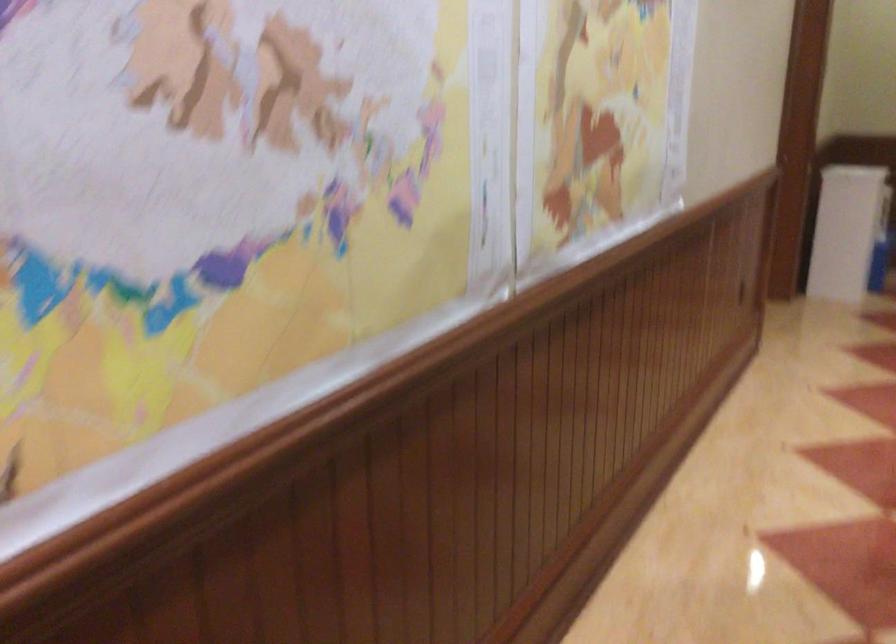
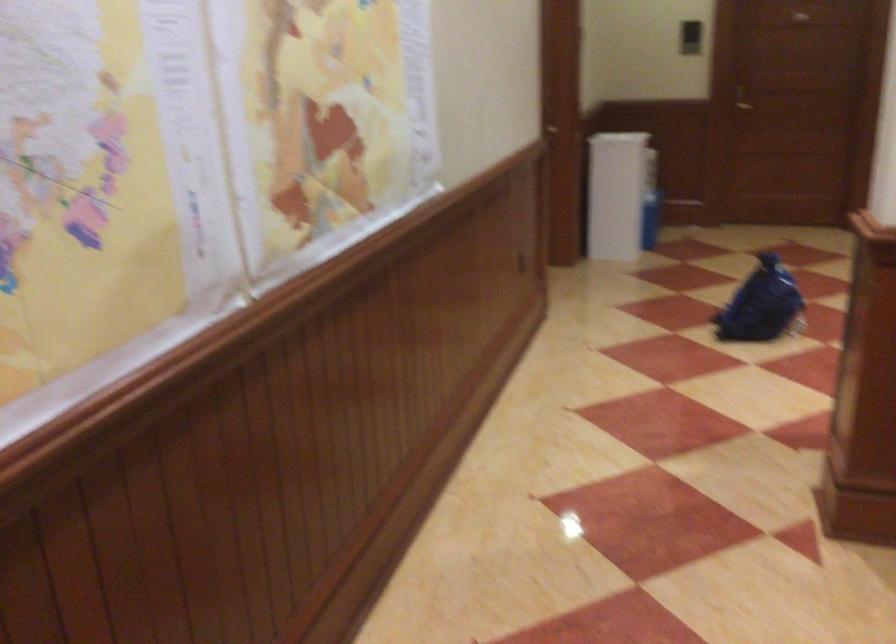
Locate, in the second image, the point that corresponds to [847,232] in the first image.

(608, 211)